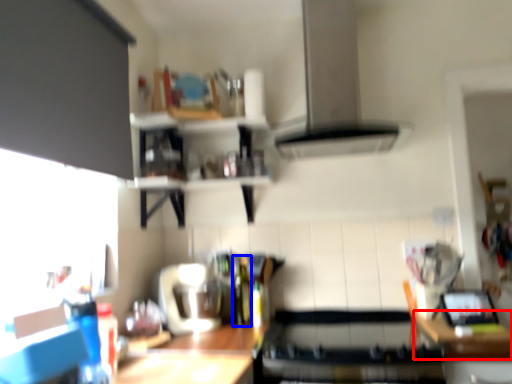
Question: Which object is closer to the camera taking this photo, counter top (highlighted by a red box) or bottle (highlighted by a blue box)?

Choices:
 (A) counter top
 (B) bottle

Answer: (A)